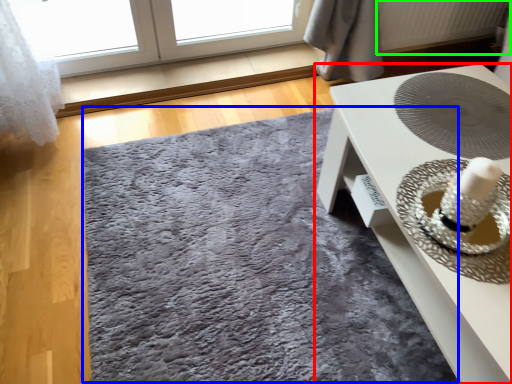
Question: Which is nearer to the table (highlighted by a red box)? mat (highlighted by a blue box) or radiator (highlighted by a green box).

Choices:
 (A) mat
 (B) radiator

Answer: (A)